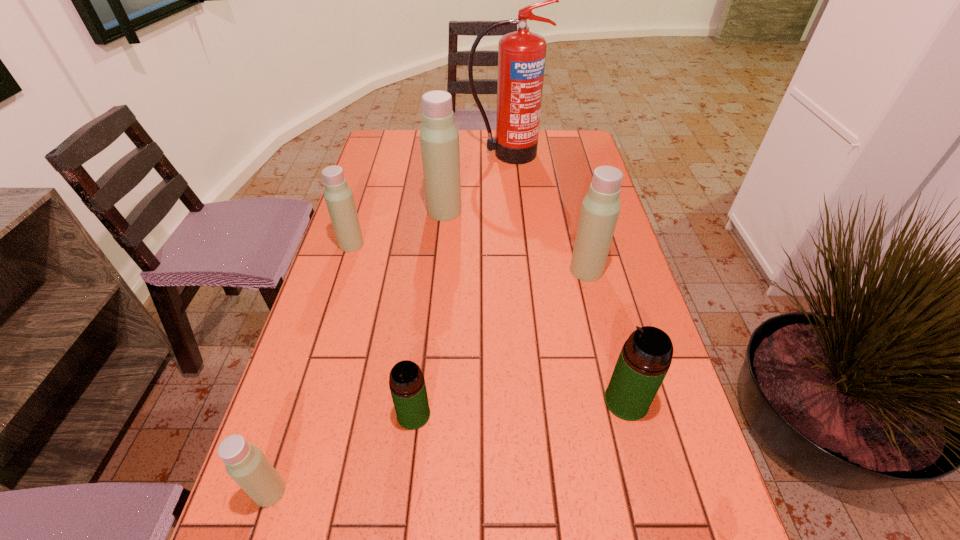
Image resolution: width=960 pixels, height=540 pixels. In order to click on fire extinguisher in this screenshot , I will do `click(521, 54)`.

You are a GUI agent. You are given a task and a screenshot of the screen. Output one action in this format:
    pyautogui.click(x=<x>, y=<y>)
    Task: Click on the third object from right to left
    Image resolution: width=960 pixels, height=540 pixels.
    Given the screenshot: What is the action you would take?
    pyautogui.click(x=521, y=54)

Where is `the second tallest object`? This screenshot has height=540, width=960. the second tallest object is located at coordinates (439, 137).

Where is `the third light thermos bottle from left to right`? The height and width of the screenshot is (540, 960). the third light thermos bottle from left to right is located at coordinates (439, 137).

Find the location of `the rightmost light thermos bottle`. the rightmost light thermos bottle is located at coordinates (600, 208).

This screenshot has height=540, width=960. I want to click on the second nearest light thermos bottle, so click(x=600, y=208).

Locate an element on the screen. The height and width of the screenshot is (540, 960). the second farthest thermos bottle is located at coordinates (339, 199).

Locate an element on the screen. The width and height of the screenshot is (960, 540). the fifth nearest object is located at coordinates (339, 199).

The height and width of the screenshot is (540, 960). I want to click on the bigger green thermos bottle, so click(x=646, y=356).

In order to click on the smaller green thermos bottle in this screenshot , I will do `click(407, 385)`.